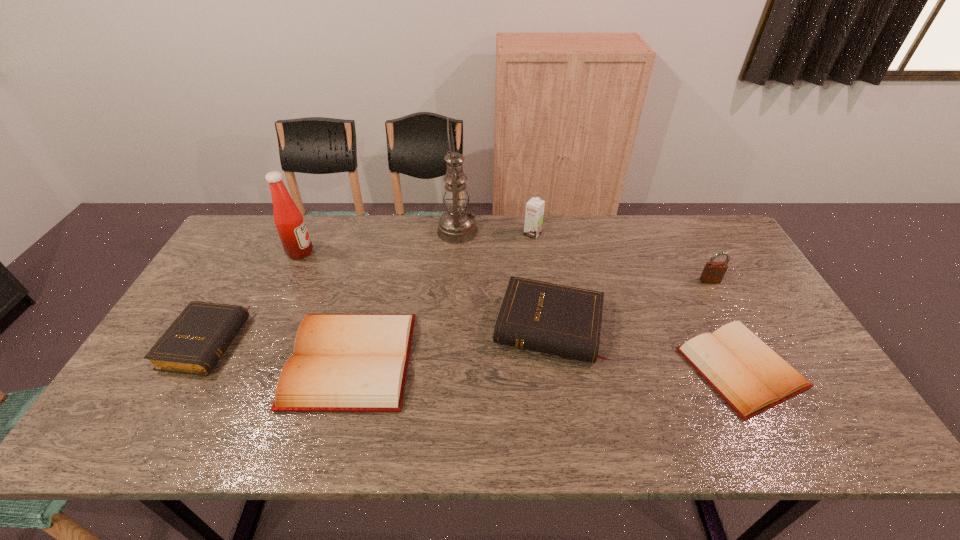
Locate an element on the screen. free space in the image that satisfies the following two spatial constraints: 1. on the front side of the fifth tallest object; 2. on the left side of the rightmost Bible is located at coordinates (554, 368).

At what (x,y) coordinates should I click in order to perform the action: click on blank space that satisfies the following two spatial constraints: 1. on the front-facing side of the second tallest object; 2. on the right side of the shortest Bible. Please return your answer as a coordinate pair (x, y). The height and width of the screenshot is (540, 960). Looking at the image, I should click on (247, 368).

Find the location of a particular element. vacant point that satisfies the following two spatial constraints: 1. on the front side of the shortest Bible; 2. on the left side of the left gray Bible is located at coordinates (191, 368).

This screenshot has height=540, width=960. I want to click on free space that satisfies the following two spatial constraints: 1. on the front side of the brown chocolate milk; 2. on the left side of the smaller red Bible, so click(552, 368).

I want to click on vacant point that satisfies the following two spatial constraints: 1. on the front-facing side of the left red Bible; 2. on the left side of the red condiment, so [251, 360].

Find the location of a particular element. free point that satisfies the following two spatial constraints: 1. on the front-facing side of the second tallest object; 2. on the back side of the fifth tallest object is located at coordinates (265, 327).